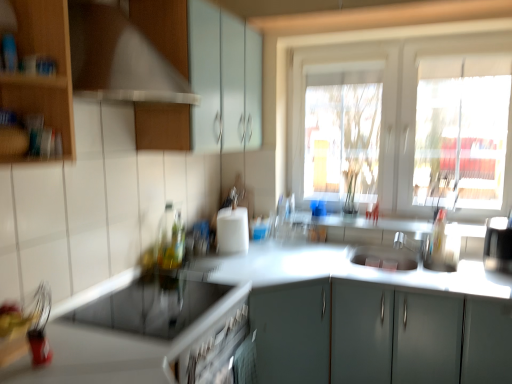
Image resolution: width=512 pixels, height=384 pixels. I want to click on vacant area that lies between translucent glass bottle at center, which ranks as the 2th bottle in back-to-front order, and white matte paper towel holder at center, so click(x=209, y=258).